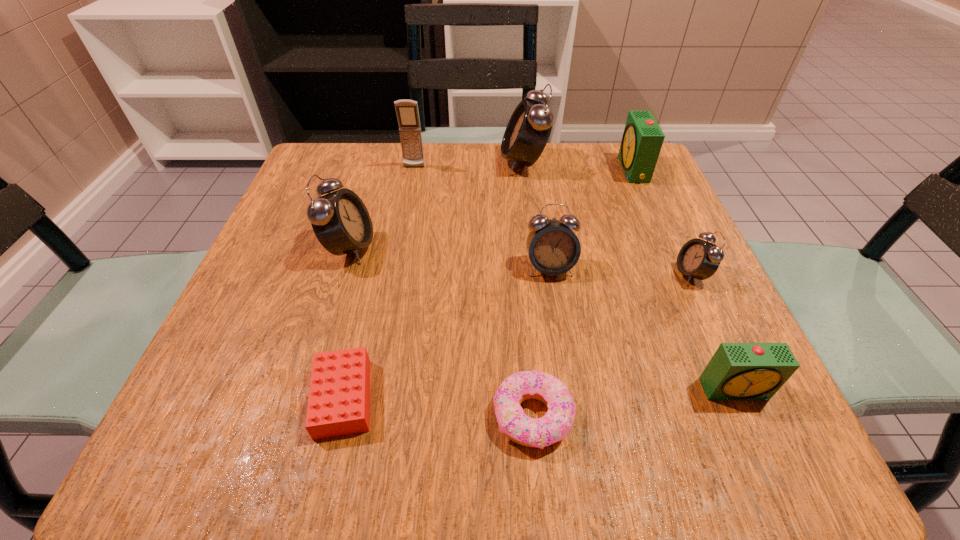
Where is `Lego`? Lego is located at coordinates 339,396.

Where is `pink doughnut`? Image resolution: width=960 pixels, height=540 pixels. pink doughnut is located at coordinates (554, 426).

Locate an element on the screen. The image size is (960, 540). free spot located 0.360m on the face of the tallest alarm clock is located at coordinates [x=348, y=163].

Where is `vacant space situated on the face of the tallest alarm clock`? This screenshot has width=960, height=540. vacant space situated on the face of the tallest alarm clock is located at coordinates (470, 163).

The height and width of the screenshot is (540, 960). Identify the location of free location located 0.110m on the face of the tallest alarm clock. (454, 163).

Where is `free location located on the front-facing side of the gray cellular telephone`? The width and height of the screenshot is (960, 540). free location located on the front-facing side of the gray cellular telephone is located at coordinates (x=404, y=221).

Locate an element on the screen. Image resolution: width=960 pixels, height=540 pixels. vacant region located 0.170m on the face of the leftmost white alarm clock is located at coordinates (464, 247).

Locate an element on the screen. Image resolution: width=960 pixels, height=540 pixels. vacant space located on the face of the third biggest white alarm clock is located at coordinates (573, 415).

The image size is (960, 540). In order to click on free region located 0.350m on the front-facing side of the bigger green alarm clock in this screenshot , I will do `click(471, 170)`.

Locate an element on the screen. This screenshot has height=540, width=960. free spot located on the front-facing side of the bigger green alarm clock is located at coordinates (532, 170).